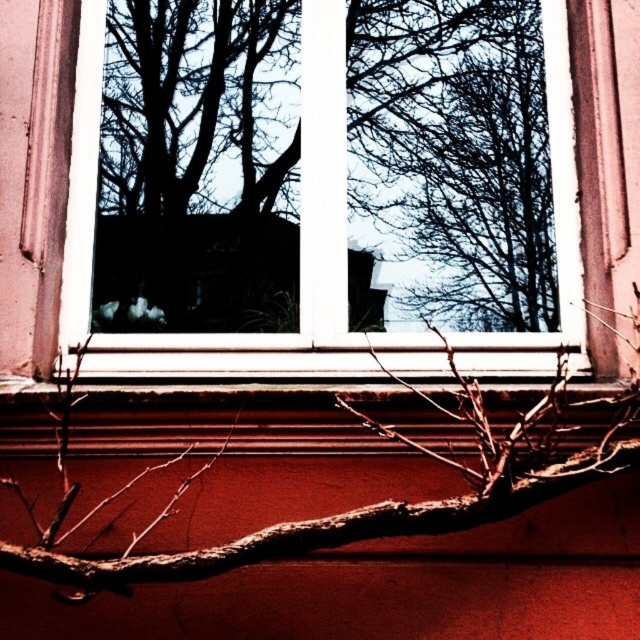
Is point (589, 346) positioned in front of point (134, 28)?

Yes, it is.

Which is more to the right, white plastic window frame at center or black silhouette tree at center?

Positioned to the right is white plastic window frame at center.

Locate an element on the screen. white plastic window frame at center is located at coordinates (45, 176).

Does point (296, 312) come closer to viewer compared to point (470, 525)?

No, (296, 312) is further to viewer.

Is black silhouette tree at center wider than brown rough branch at lower center?

In fact, black silhouette tree at center might be narrower than brown rough branch at lower center.

Identify the location of black silhouette tree at center. Image resolution: width=640 pixels, height=640 pixels. (193, 163).

At what (x,y) coordinates should I click in order to perform the action: click on black silhouette tree at center. Please return your answer as a coordinate pair (x, y). The image size is (640, 640). Looking at the image, I should click on (193, 163).

Does black silhouette tree at center appear on the right side of silhouette bare branches at upper center?

No, black silhouette tree at center is not to the right of silhouette bare branches at upper center.

From the picture: Is black silhouette tree at center smaller than silhouette bare branches at upper center?

No, black silhouette tree at center is not smaller than silhouette bare branches at upper center.

The height and width of the screenshot is (640, 640). What do you see at coordinates (193, 163) in the screenshot? I see `black silhouette tree at center` at bounding box center [193, 163].

You are a GUI agent. You are given a task and a screenshot of the screen. Output one action in this format:
    pyautogui.click(x=<x>, y=<y>)
    Task: Click on the black silhouette tree at center
    The image size is (640, 640).
    Given the screenshot: What is the action you would take?
    pyautogui.click(x=193, y=163)